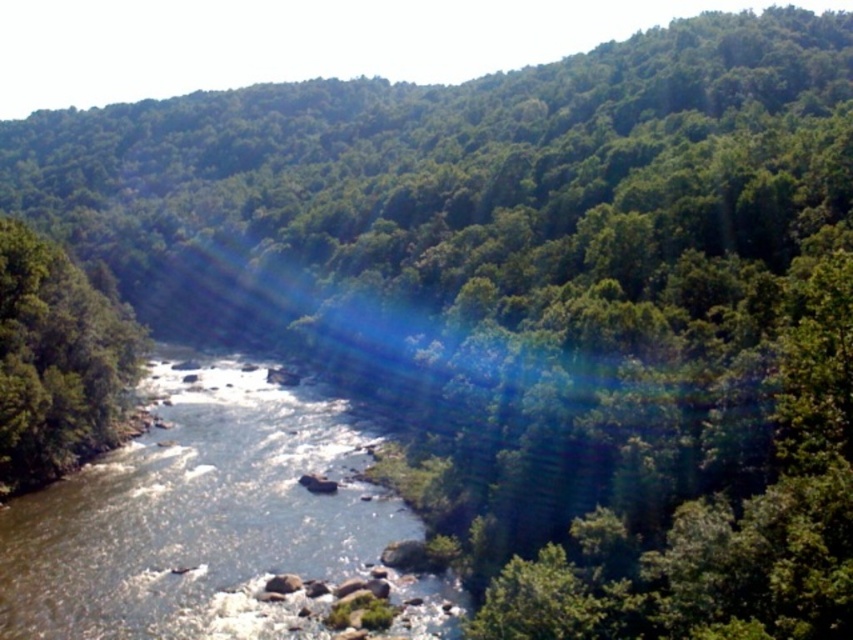
Based on the photo, is clear water at center above green leafy tree at left?

No.

Who is more distant from viewer, (6, 541) or (61, 419)?

The point (61, 419) is behind.

Identify the location of clear water at center. This screenshot has height=640, width=853. (199, 516).